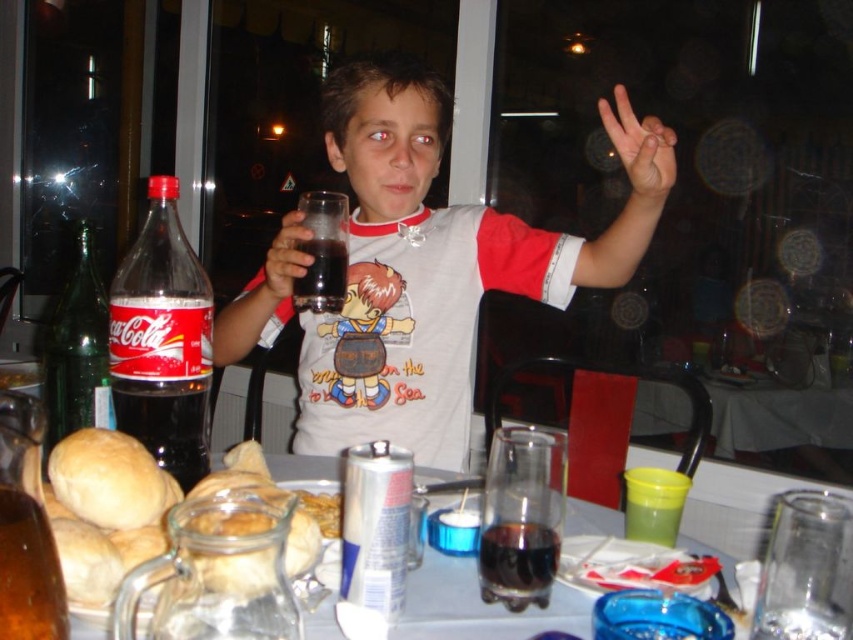
Question: Which object is positioned closest to the translucent plastic bottle at left?

Choices:
 (A) matte skin hand at upper right
 (B) golden bread rolls at lower left

Answer: (B)

Question: Does green glass bottle at left have a larger size compared to matte skin hand at upper right?

Choices:
 (A) yes
 (B) no

Answer: (B)

Question: Does matte black glass at center have a larger size compared to translucent glass at center?

Choices:
 (A) yes
 (B) no

Answer: (A)

Question: Is translucent plastic bottle at left above golden bread rolls at lower left?

Choices:
 (A) no
 (B) yes

Answer: (B)

Question: Estimate the real-world distances between objects in this image. Which object is farther from the golden bread rolls at lower left?

Choices:
 (A) green glass bottle at left
 (B) matte black glass at center
 (C) matte skin hand at upper right
 (D) translucent plastic bottle at left

Answer: (C)

Question: Which point is closer to the camera?

Choices:
 (A) matte skin hand at upper right
 (B) translucent plastic bottle at left
 (C) golden bread rolls at lower left

Answer: (C)